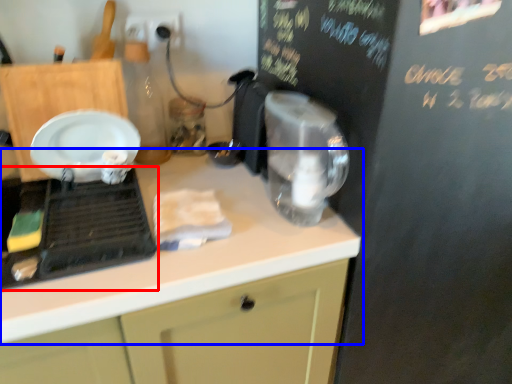
Question: Among these objects, which one is nearest to the camera, home appliance (highlighted by a red box) or countertop (highlighted by a blue box)?

Choices:
 (A) home appliance
 (B) countertop

Answer: (B)